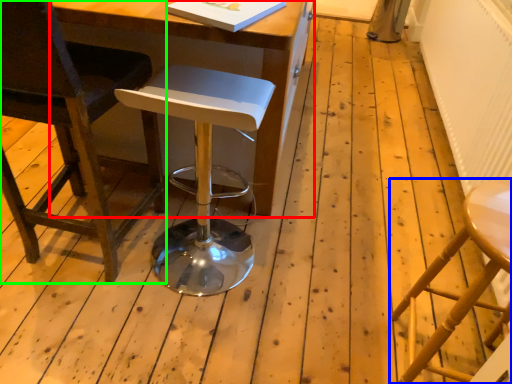
Question: Estimate the real-world distances between objects in this image. Which object is farther from table (highlighted by a red box), stool (highlighted by a blue box) or chair (highlighted by a green box)?

Choices:
 (A) stool
 (B) chair

Answer: (A)